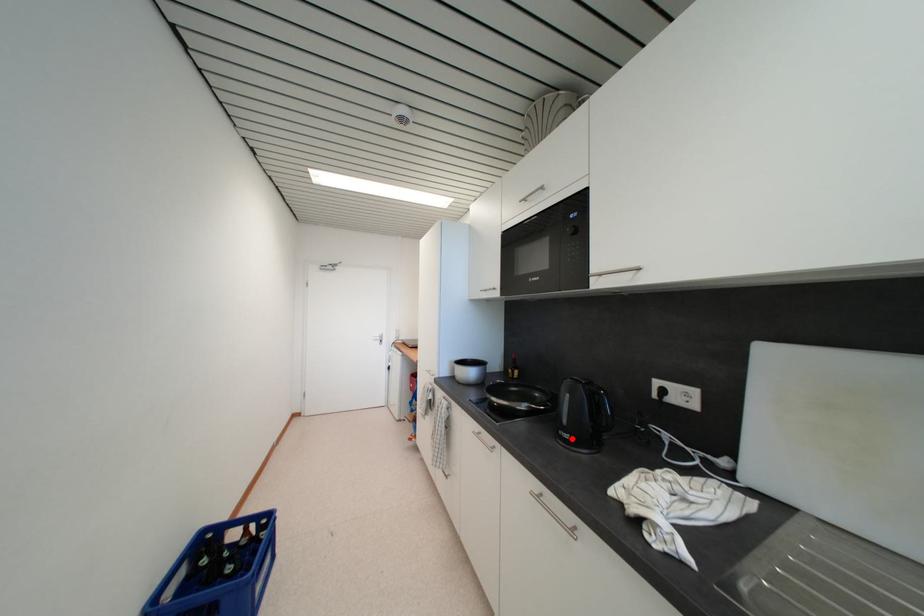
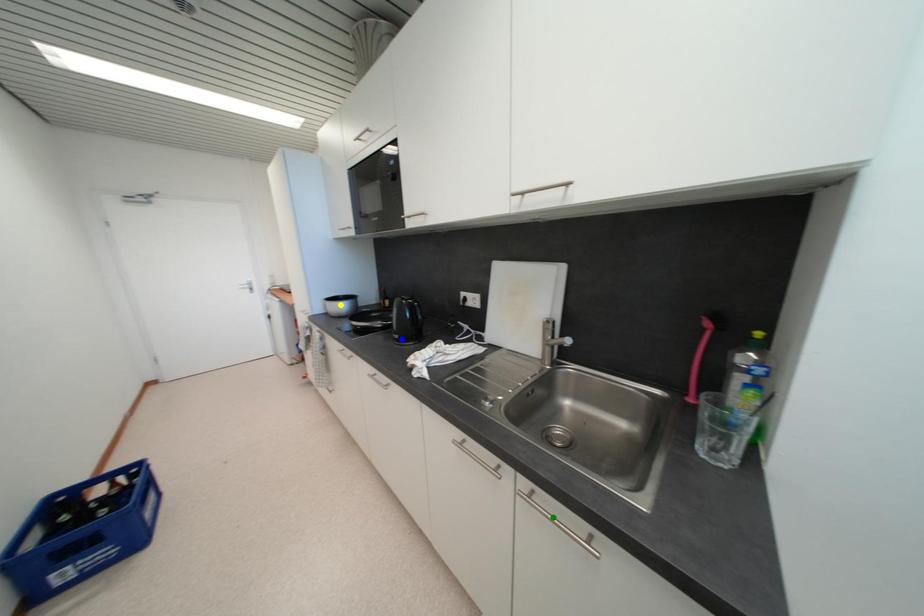
Question: I am providing you with two images of the same scene from different viewpoints. A red point is marked on the first image. You are given multiple points on the second image. Which spot in image 2 lines up with the point in image 1?

Choices:
 (A) blue point
 (B) green point
 (C) yellow point

Answer: (A)